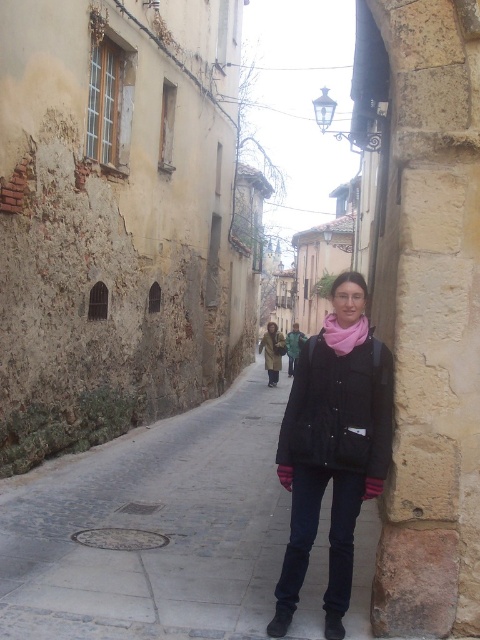
You are a tour guide leading a group through the historic town. You notice a black matte jacket at center and a brown leather boot at lower center on the cobblestone street. If your group wants to place a 1.5 meter long banner between them, will there be enough space?

The black matte jacket at center and brown leather boot at lower center are 1.25 meters apart. Since the banner is 1.5 meters long, it will not fit between them as the distance is shorter than the banner.

You are a delivery person who needs to deliver a package to the person wearing the black matte jacket at center and the pink soft scarf at center. Since you can only see the top of their heads from your current position, which object should you look for to identify the correct person?

The pink soft scarf at center is taller than the black matte jacket at center, so you should look for the taller object, which is the pink soft scarf at center.